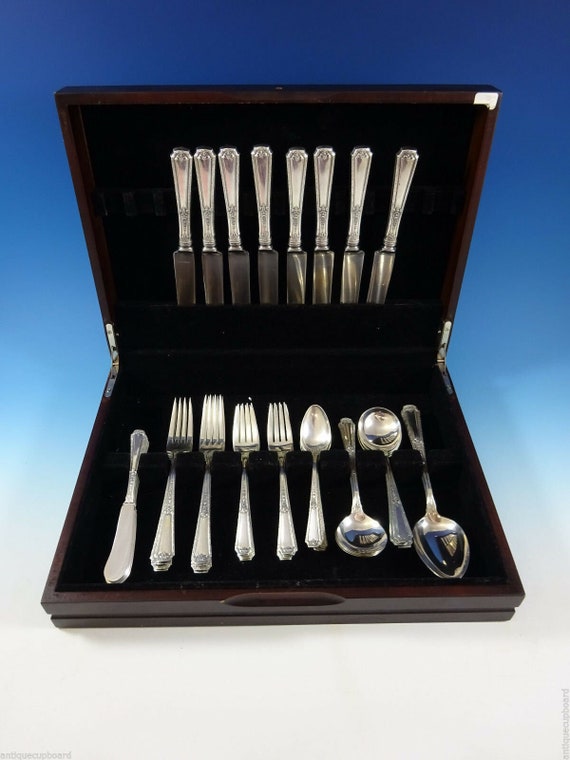
Locate an element on the screen. The image size is (570, 760). forks shown is located at coordinates (275, 432), (242, 439), (202, 423), (191, 429).